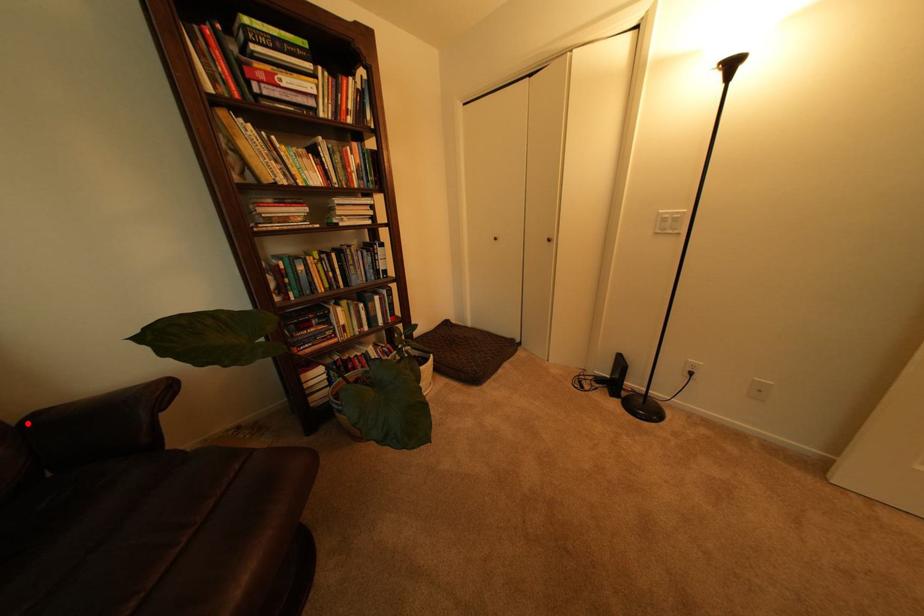
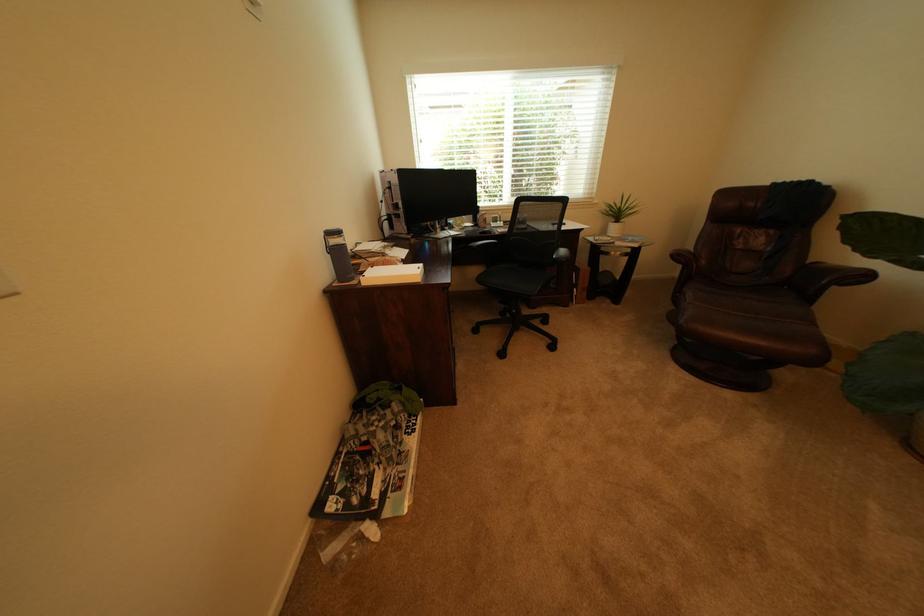
Find the pixel in the second image that matches the highlighted location in the first image.

(821, 262)